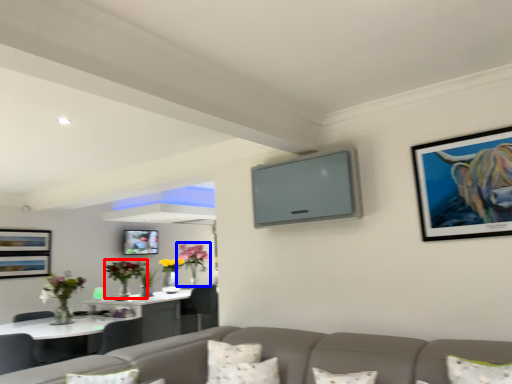
Question: Which object appears farthest to the camera in this image, floral arrangement (highlighted by a red box) or floral arrangement (highlighted by a blue box)?

Choices:
 (A) floral arrangement
 (B) floral arrangement

Answer: (B)